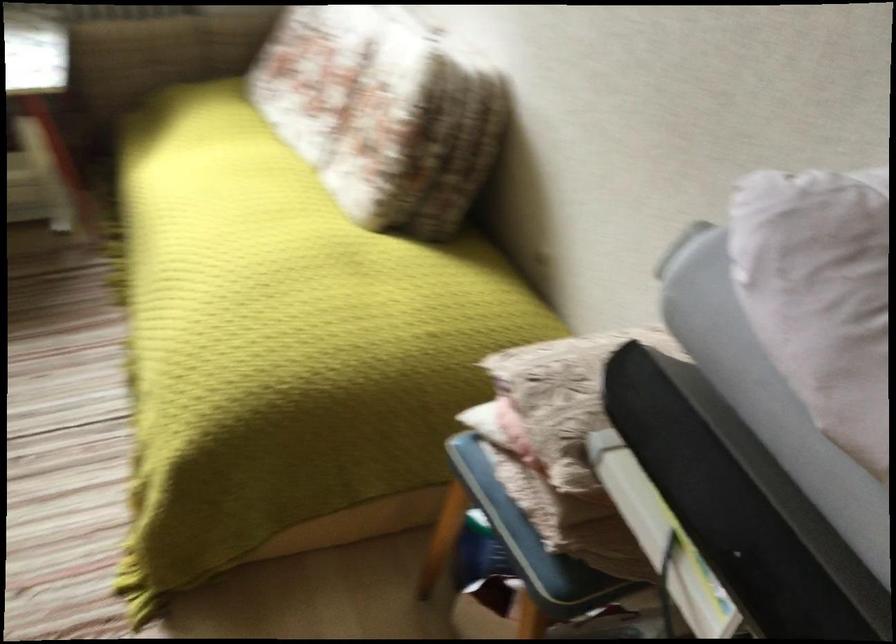
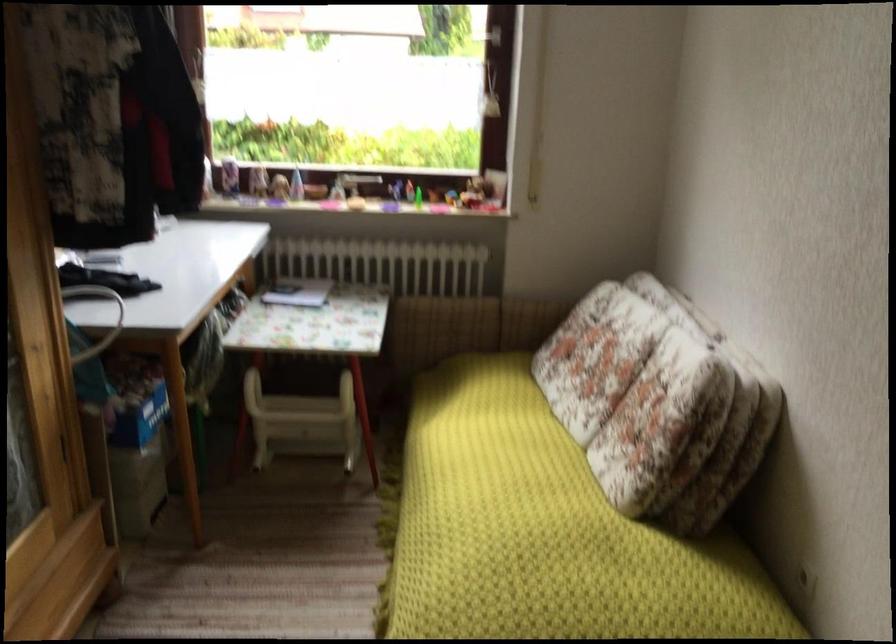
Find the pixel in the second image that matches (x=378, y=111) in the first image.

(658, 402)